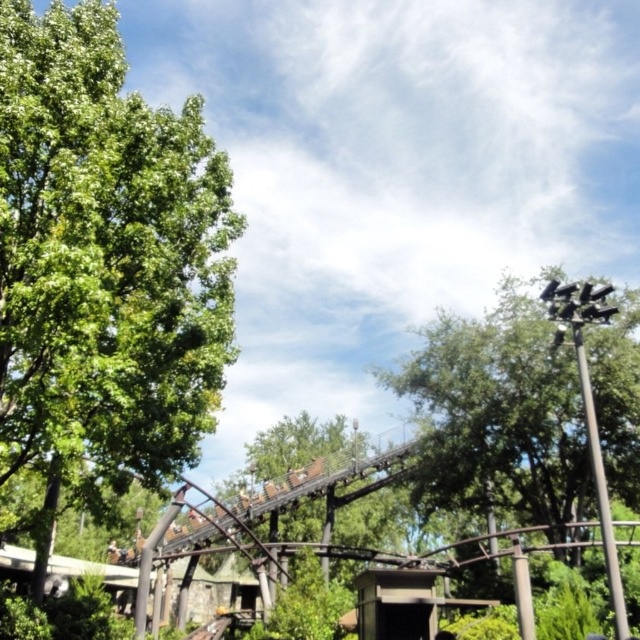
Question: Which of the following is the closest to the observer?

Choices:
 (A) green leafy tree at left
 (B) green leafy tree at upper right

Answer: (A)

Question: Can you confirm if green leafy tree at left is thinner than green leafy tree at upper right?

Choices:
 (A) yes
 (B) no

Answer: (A)

Question: Which object appears farthest from the camera in this image?

Choices:
 (A) green leafy tree at upper right
 (B) green leafy tree at left

Answer: (A)

Question: Which of the following is the closest to the observer?

Choices:
 (A) green leafy tree at upper right
 (B) green leafy tree at left

Answer: (B)

Question: Is green leafy tree at left thinner than green leafy tree at upper right?

Choices:
 (A) yes
 (B) no

Answer: (A)

Question: Can you confirm if green leafy tree at left is wider than green leafy tree at upper right?

Choices:
 (A) no
 (B) yes

Answer: (A)